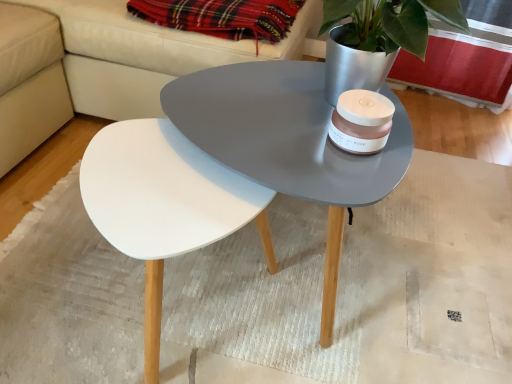
Question: From the image's perspective, is white leather couch at upper center on top of white matte mat at center?

Choices:
 (A) yes
 (B) no

Answer: (A)

Question: Is white leather couch at upper center facing away from white matte mat at center?

Choices:
 (A) no
 (B) yes

Answer: (A)

Question: Can you confirm if white leather couch at upper center is shorter than white matte mat at center?

Choices:
 (A) yes
 (B) no

Answer: (B)

Question: Is white leather couch at upper center at the left side of white matte mat at center?

Choices:
 (A) yes
 (B) no

Answer: (A)

Question: From the image's perspective, is white leather couch at upper center beneath white matte mat at center?

Choices:
 (A) no
 (B) yes

Answer: (A)

Question: Is white leather couch at upper center further to the viewer compared to white matte mat at center?

Choices:
 (A) yes
 (B) no

Answer: (A)

Question: Can you confirm if plaid fabric at upper center is smaller than white matte mat at center?

Choices:
 (A) yes
 (B) no

Answer: (A)

Question: Is plaid fabric at upper center to the left of white matte mat at center from the viewer's perspective?

Choices:
 (A) no
 (B) yes

Answer: (B)

Question: Could white matte mat at center be considered to be inside plaid fabric at upper center?

Choices:
 (A) yes
 (B) no

Answer: (B)

Question: Is white matte mat at center at the back of plaid fabric at upper center?

Choices:
 (A) yes
 (B) no

Answer: (B)

Question: Considering the relative positions of plaid fabric at upper center and white matte mat at center in the image provided, is plaid fabric at upper center in front of white matte mat at center?

Choices:
 (A) yes
 (B) no

Answer: (B)

Question: Are plaid fabric at upper center and white matte mat at center located far from each other?

Choices:
 (A) yes
 (B) no

Answer: (B)

Question: Can you confirm if white matte mat at center is smaller than white leather couch at upper center?

Choices:
 (A) no
 (B) yes

Answer: (B)